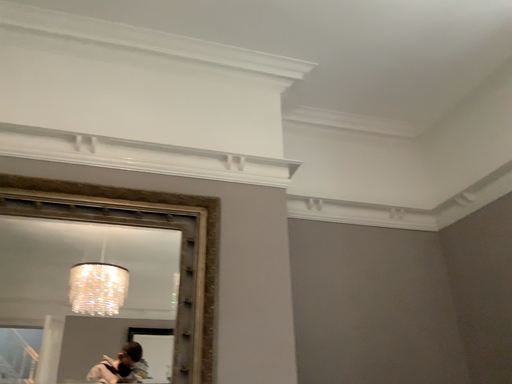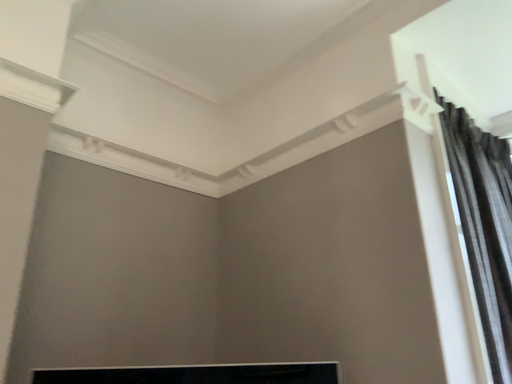
Question: How did the camera likely rotate when shooting the video?

Choices:
 (A) rotated left
 (B) rotated right

Answer: (B)